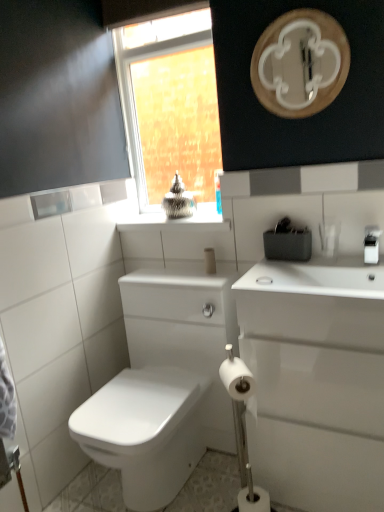
You are a GUI agent. You are given a task and a screenshot of the screen. Output one action in this format:
    pyautogui.click(x=<x>, y=<y>)
    Task: Click on the unoccupied area behind white matte soap at center
    The image size is (384, 512).
    Given the screenshot: What is the action you would take?
    pyautogui.click(x=264, y=271)